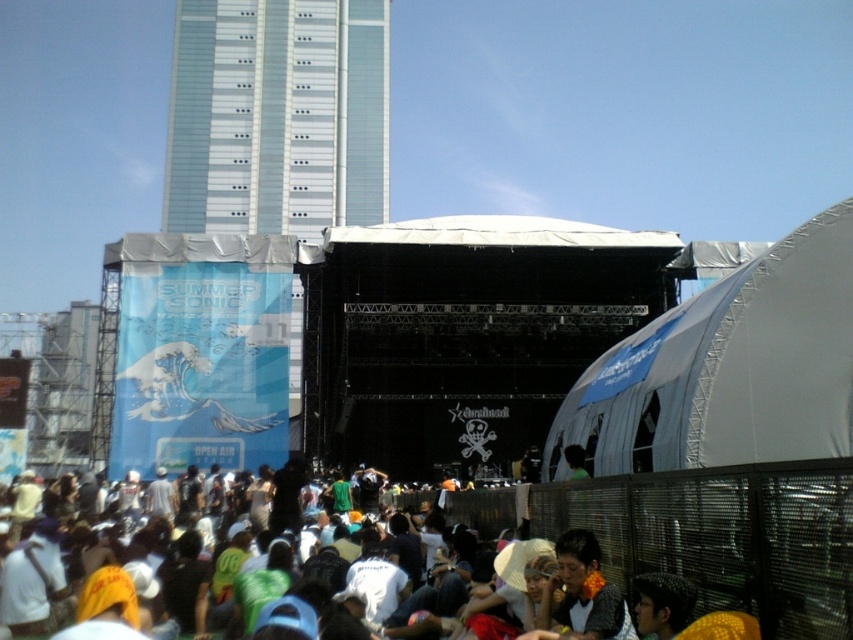
Question: Which point is closer to the camera?

Choices:
 (A) (198, 179)
 (B) (508, 634)

Answer: (B)

Question: Which of the following is the closest to the observer?

Choices:
 (A) white cotton shirt at lower center
 (B) glassy steel tower at upper left

Answer: (A)

Question: Can you confirm if white cotton shirt at lower center is positioned to the right of glassy steel tower at upper left?

Choices:
 (A) no
 (B) yes

Answer: (B)

Question: Does white cotton shirt at lower center have a larger size compared to glassy steel tower at upper left?

Choices:
 (A) yes
 (B) no

Answer: (B)

Question: Is white cotton shirt at lower center to the right of glassy steel tower at upper left from the viewer's perspective?

Choices:
 (A) no
 (B) yes

Answer: (B)